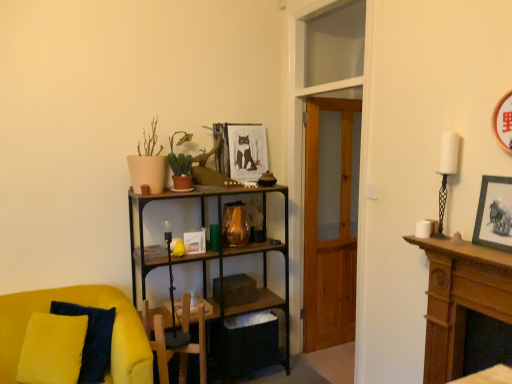
Question: From the image's perspective, is beige matte pot at upper left, placed as the first houseplant when sorted from front to back, above or below matte black picture frame at upper right, placed as the 2th picture frame when sorted from back to front?

Choices:
 (A) above
 (B) below

Answer: (A)

Question: From a real-world perspective, relative to matte black picture frame at upper right, which appears as the first picture frame when viewed from the front, is beige matte pot at upper left, arranged as the 2th houseplant when viewed from the back, vertically above or below?

Choices:
 (A) below
 (B) above

Answer: (B)

Question: Which of these objects is positioned closest to the beige matte pot at upper left, placed as the first houseplant when sorted from front to back?

Choices:
 (A) wooden swivel chair at center
 (B) wooden framed picture at center, marked as the 2th picture frame in a front-to-back arrangement
 (C) matte black picture frame at upper right, which appears as the first picture frame when viewed from the front
 (D) velvet yellow armchair at lower left
 (E) green matte cactus at upper center, which is counted as the second houseplant, starting from the front

Answer: (E)

Question: Which is nearer to the green matte cactus at upper center, which is counted as the second houseplant, starting from the front?

Choices:
 (A) matte black picture frame at upper right, which appears as the first picture frame when viewed from the front
 (B) velvet yellow armchair at lower left
 (C) beige matte pot at upper left, placed as the first houseplant when sorted from front to back
 (D) wooden swivel chair at center
 (E) wooden framed picture at center, marked as the second picture frame in a right-to-left arrangement

Answer: (C)